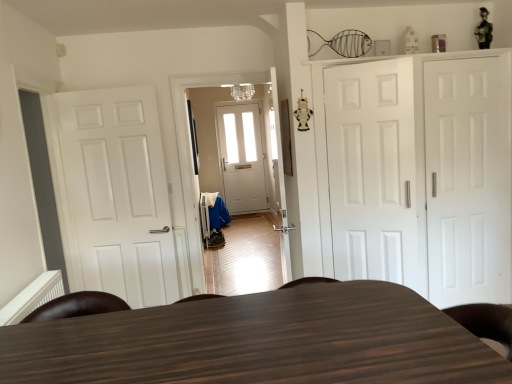
Question: Can you confirm if white matte cabinet at right is thinner than white matte door at right, the 1th door viewed from the right?

Choices:
 (A) no
 (B) yes

Answer: (A)

Question: From the image's perspective, is white matte cabinet at right located beneath white matte door at right, the 1th door viewed from the right?

Choices:
 (A) yes
 (B) no

Answer: (B)

Question: Is white matte cabinet at right to the right of white matte door at right, the 1th door viewed from the right, from the viewer's perspective?

Choices:
 (A) no
 (B) yes

Answer: (A)

Question: Is white matte cabinet at right in front of white matte door at right, arranged as the 3th door when viewed from the left?

Choices:
 (A) yes
 (B) no

Answer: (A)

Question: Could you tell me if white matte cabinet at right is turned towards white matte door at right, arranged as the 3th door when viewed from the left?

Choices:
 (A) no
 (B) yes

Answer: (B)

Question: Is white matte cabinet at right bigger than white matte door at right, arranged as the 3th door when viewed from the left?

Choices:
 (A) yes
 (B) no

Answer: (A)

Question: Is dark wood table at center positioned in front of white matte door at center, arranged as the 2th door when viewed from the right?

Choices:
 (A) no
 (B) yes

Answer: (B)

Question: Is dark wood table at center looking in the opposite direction of white matte door at center, placed as the 2th door when sorted from left to right?

Choices:
 (A) yes
 (B) no

Answer: (A)

Question: Are dark wood table at center and white matte door at center, placed as the 2th door when sorted from left to right, making contact?

Choices:
 (A) no
 (B) yes

Answer: (A)

Question: From a real-world perspective, is dark wood table at center under white matte door at center, arranged as the 2th door when viewed from the right?

Choices:
 (A) no
 (B) yes

Answer: (B)

Question: From the image's perspective, is dark wood table at center on white matte door at center, placed as the 2th door when sorted from left to right?

Choices:
 (A) no
 (B) yes

Answer: (A)

Question: Can white matte door at center, placed as the 2th door when sorted from left to right, be found inside dark wood table at center?

Choices:
 (A) yes
 (B) no

Answer: (B)

Question: Could you tell me if white matte door at left, which is counted as the 3th door, starting from the right, is facing white matte door at center, placed as the 2th door when sorted from left to right?

Choices:
 (A) yes
 (B) no

Answer: (B)